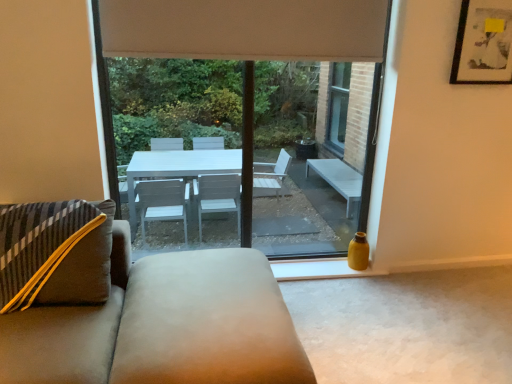
Question: Is suede ottoman at center taller or shorter than beige fabric curtain at upper center?

Choices:
 (A) tall
 (B) short

Answer: (A)

Question: From a real-world perspective, is suede ottoman at center positioned above or below beige fabric curtain at upper center?

Choices:
 (A) above
 (B) below

Answer: (B)

Question: Estimate the real-world distances between objects in this image. Which object is closer to the beige fabric curtain at upper center?

Choices:
 (A) matte black picture frame at upper right
 (B) suede ottoman at center
 (C) transparent glass window at center

Answer: (A)

Question: Estimate the real-world distances between objects in this image. Which object is closer to the transparent glass window at center?

Choices:
 (A) matte black picture frame at upper right
 (B) beige fabric curtain at upper center
 (C) suede ottoman at center

Answer: (A)